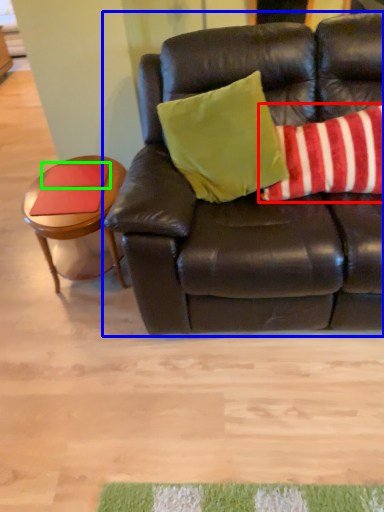
Question: Which object is positioned closest to pillow (highlighted by a red box)? Select from studio couch (highlighted by a blue box) and pad (highlighted by a green box).

Choices:
 (A) studio couch
 (B) pad

Answer: (A)